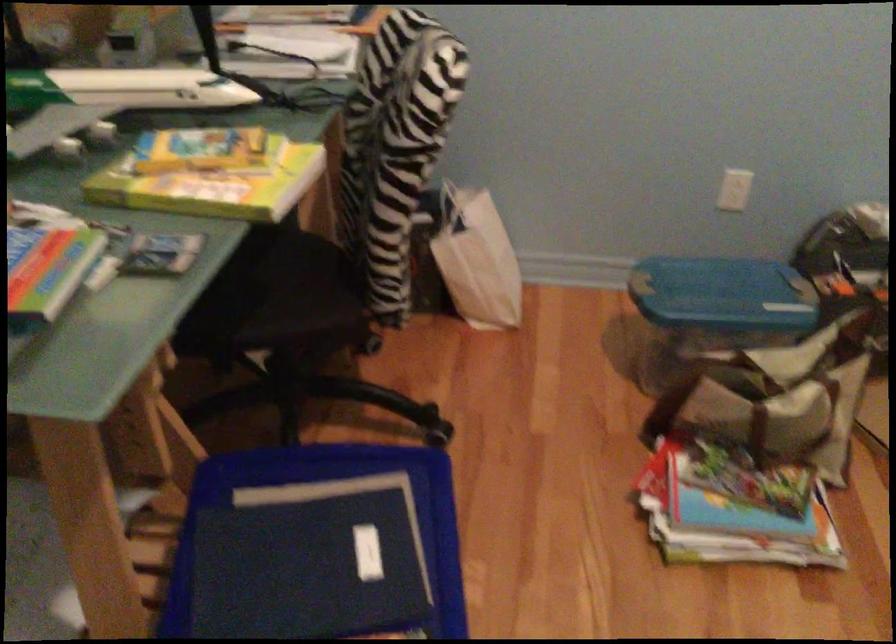
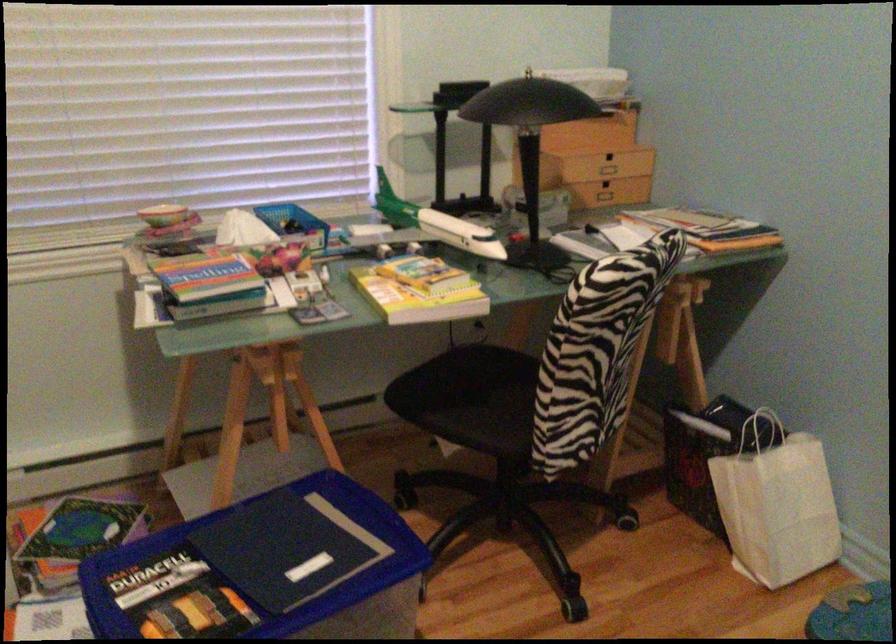
Locate, in the second image, the point that corresponds to pixel 341 538 in the first image.

(316, 551)